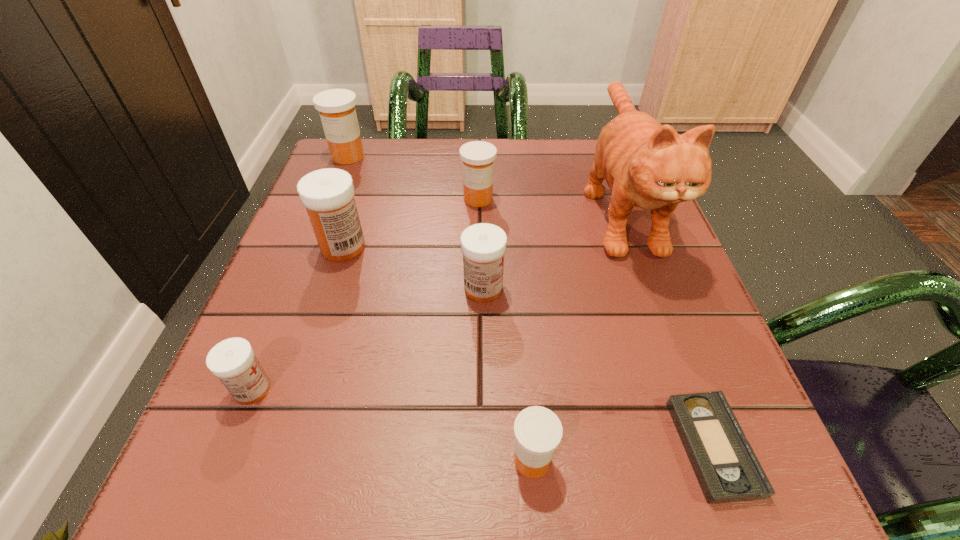
This screenshot has height=540, width=960. Identify the location of vacant space located on the back of the nearest white medicine. pyautogui.click(x=310, y=245).

Identify the location of vacant region located 0.270m on the label of the nearest medicine. The image size is (960, 540). (304, 460).

Identify the location of blank space located on the label of the nearest medicine. Image resolution: width=960 pixels, height=540 pixels. (366, 460).

At what (x,y) coordinates should I click in order to perform the action: click on free location located on the label of the nearest medicine. Please return your answer as a coordinate pair (x, y). Image resolution: width=960 pixels, height=540 pixels. Looking at the image, I should click on (411, 460).

The height and width of the screenshot is (540, 960). I want to click on vacant point located on the left of the videotape, so click(635, 447).

Image resolution: width=960 pixels, height=540 pixels. What are the coordinates of `cat that is positioned at the far edge` in the screenshot? It's located at (647, 165).

The image size is (960, 540). I want to click on medicine at the near edge, so (x=538, y=431).

Identify the location of videotape situated at the near edge. (727, 469).

At what (x,y) coordinates should I click in order to perform the action: click on cat at the right edge. Please return your answer as a coordinate pair (x, y). This screenshot has height=540, width=960. Looking at the image, I should click on (647, 165).

Where is `videotape that is at the right edge`? The width and height of the screenshot is (960, 540). videotape that is at the right edge is located at coordinates (727, 469).